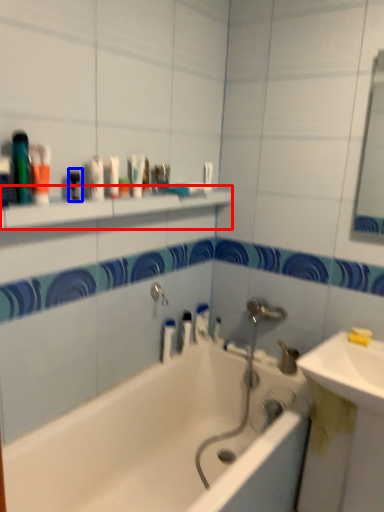
Question: Which of the following is the closest to the observer, shelve (highlighted by a red box) or mouthwash (highlighted by a blue box)?

Choices:
 (A) shelve
 (B) mouthwash

Answer: (A)